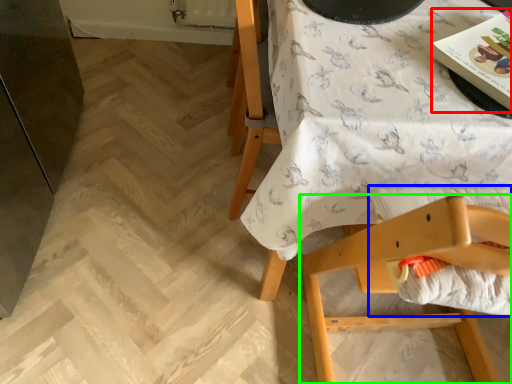
Question: Estimate the real-world distances between objects in this image. Which object is farther from magazine (highlighted by a red box), sheet (highlighted by a blue box) or chair (highlighted by a green box)?

Choices:
 (A) sheet
 (B) chair

Answer: (B)